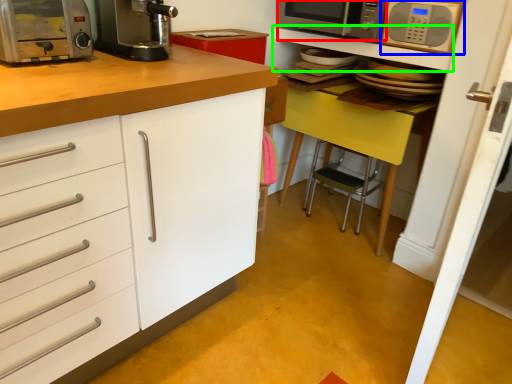
Question: Based on their relative distances, which object is farther from microwave oven (highlighted by a red box)? Choose from microwave oven (highlighted by a blue box) and shelf (highlighted by a green box).

Choices:
 (A) microwave oven
 (B) shelf

Answer: (A)